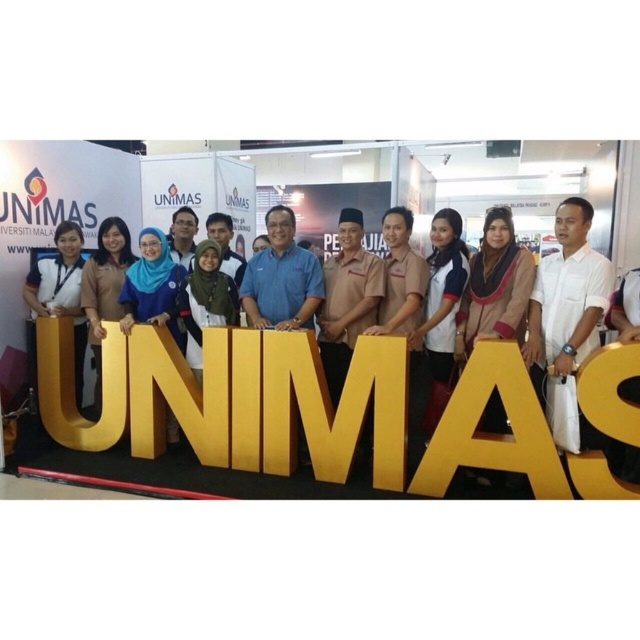
Based on the photo, you are standing at the point marked as point (496, 353) and want to move towards the entrance located 10 meters away from your current position. If you walk straight ahead, will you reach the entrance before walking 3.05 meters?

The distance between point (496, 353) and the viewer is 3.05 meters. Since the entrance is 10 meters away from your current position, walking straight ahead for 3.05 meters will not reach the entrance yet.

You are a photographer at the event and want to ensure that the matte gold letter at center and the matte black shirt at left are both visible in the photo. Which object should you focus on first to capture both in clear detail?

The matte gold letter at center is larger in size than the matte black shirt at left, so focusing on the matte gold letter at center first will ensure that both objects are in clear detail since it is the larger object and requires more attention to detail.

You are a photographer adjusting your camera settings for the group photo. You notice the matte gold letter at center and the white cotton shirt at center. Which object should you focus on first to ensure both are in sharp focus?

You should focus on the matte gold letter at center first because it is closer to the viewer than the white cotton shirt at center, so adjusting focus starting from the closer object ensures both will be sharp.